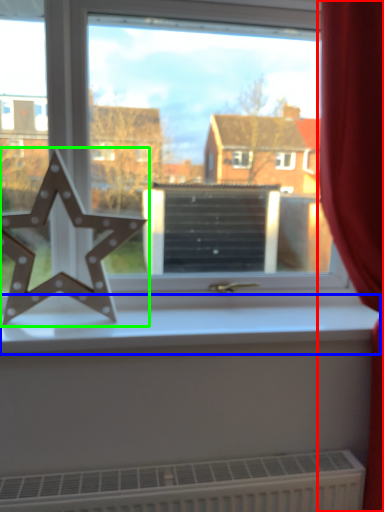
Question: Estimate the real-world distances between objects in this image. Which object is closer to curtain (highlighted by a red box), window sill (highlighted by a blue box) or letter (highlighted by a green box)?

Choices:
 (A) window sill
 (B) letter

Answer: (A)